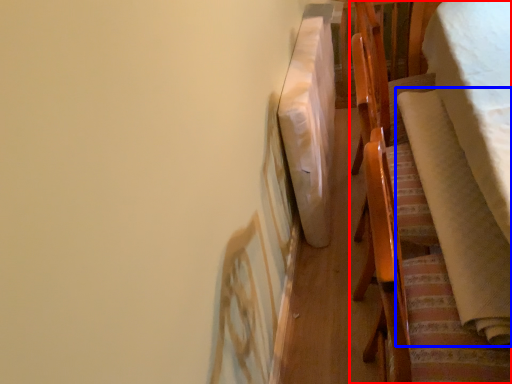
Question: Which of the following is the closest to the observer, furniture (highlighted by a red box) or blanket (highlighted by a blue box)?

Choices:
 (A) furniture
 (B) blanket

Answer: (B)